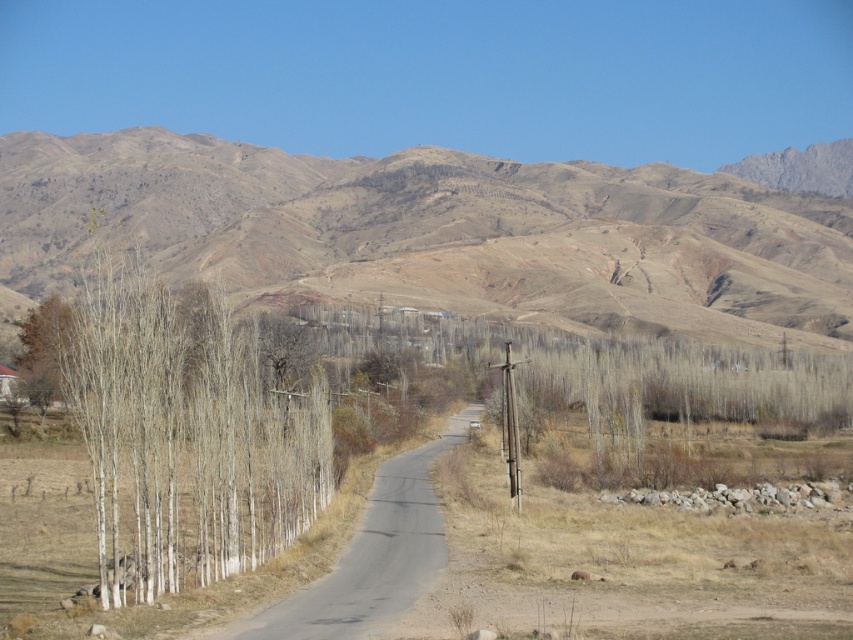
Question: Among these points, which one is farthest from the camera?

Choices:
 (A) (20, 333)
 (B) (91, 422)

Answer: (A)

Question: Does white smooth trees at left have a smaller size compared to brown matte tree at left?

Choices:
 (A) yes
 (B) no

Answer: (A)

Question: Does brown/dry soil hill at upper center appear on the left side of brown matte tree at left?

Choices:
 (A) no
 (B) yes

Answer: (A)

Question: Considering the real-world distances, which object is closest to the white smooth trees at left?

Choices:
 (A) brown matte tree at left
 (B) brown/dry soil hill at upper center

Answer: (A)

Question: Is the position of white smooth trees at left less distant than that of brown matte tree at left?

Choices:
 (A) no
 (B) yes

Answer: (B)

Question: Which point is closer to the camera?

Choices:
 (A) (283, 484)
 (B) (33, 349)

Answer: (A)